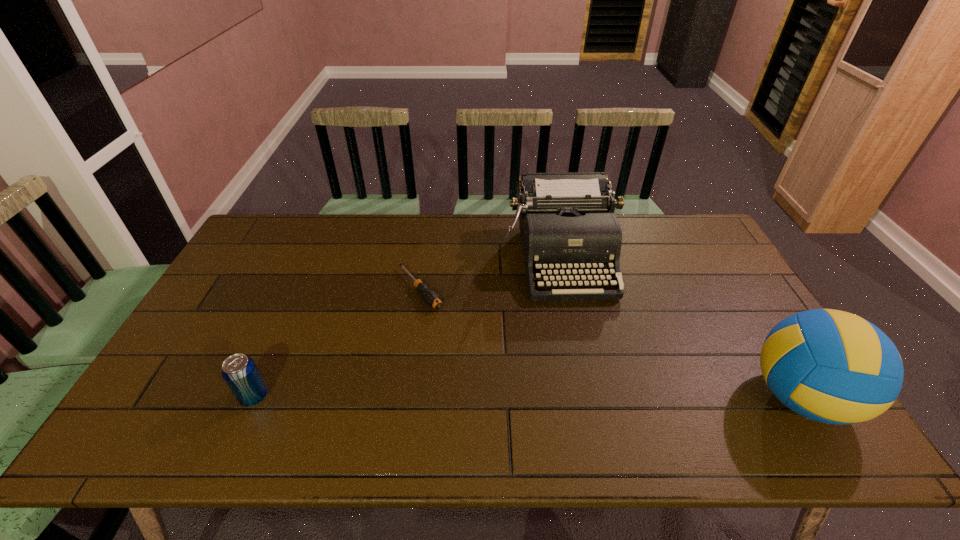
In the image, there is a desktop. Identify the location of vacant space at the far edge. (492, 234).

The width and height of the screenshot is (960, 540). What are the coordinates of `vacant space at the near edge of the desktop` in the screenshot? It's located at (644, 393).

Identify the location of vacant space at the left edge. (208, 305).

Find the location of `vacant space at the right edge`. vacant space at the right edge is located at coordinates (707, 276).

Image resolution: width=960 pixels, height=540 pixels. What are the coordinates of `empty space between the rightmost object and the screwdriver` in the screenshot? It's located at (610, 343).

Locate an element on the screen. This screenshot has height=540, width=960. empty space between the beer can and the typewriter is located at coordinates (408, 327).

This screenshot has height=540, width=960. Identify the location of free space between the volleyball and the second shortest object. (527, 397).

Find the location of a particular element. The width and height of the screenshot is (960, 540). free space between the third shortest object and the shortest object is located at coordinates (491, 274).

You are a GUI agent. You are given a task and a screenshot of the screen. Output one action in this format:
    pyautogui.click(x=<x>, y=<y>)
    Task: Click on the unoccupied area between the volleyball and the screwdriver
    Image resolution: width=960 pixels, height=540 pixels.
    Given the screenshot: What is the action you would take?
    pyautogui.click(x=610, y=343)

The width and height of the screenshot is (960, 540). In order to click on empty space between the volleyball and the second object from left to right in this screenshot , I will do `click(610, 343)`.